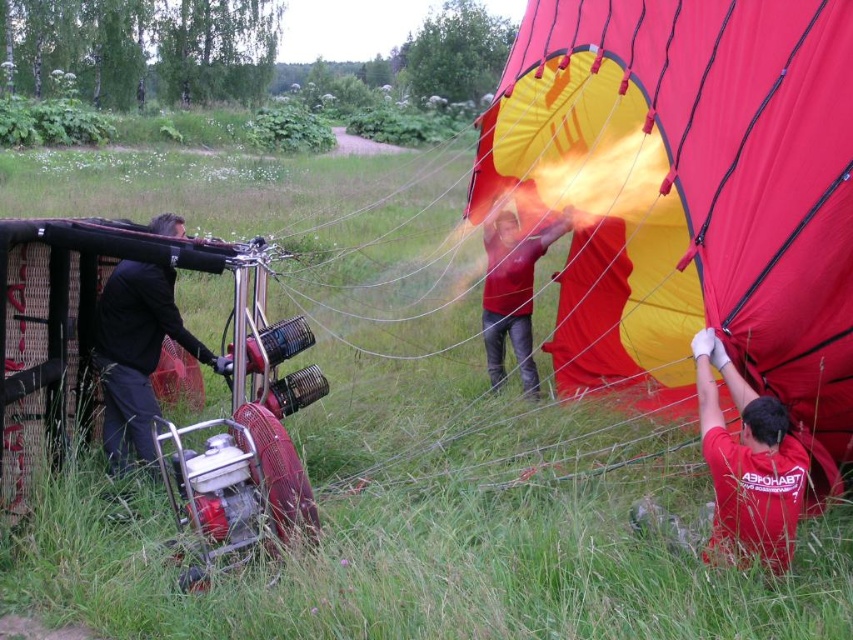
You are standing at the point with coordinates point (149, 365) and want to walk to the point with coordinates point (751, 492). Which direction should you face to walk towards your destination?

Result: You should face north because point (751, 492) is in front of point (149, 365).

You are standing in the grassy field looking at the hot air balloon setup. There are two points marked in the scene. The first point is at coordinate point (813, 161) and the second is at point (717, 448). If you were to walk directly towards the balloon envelope, which point would you encounter first?

The point at (813, 161) is closer to the camera, so you would encounter it first as you walk towards the balloon envelope.